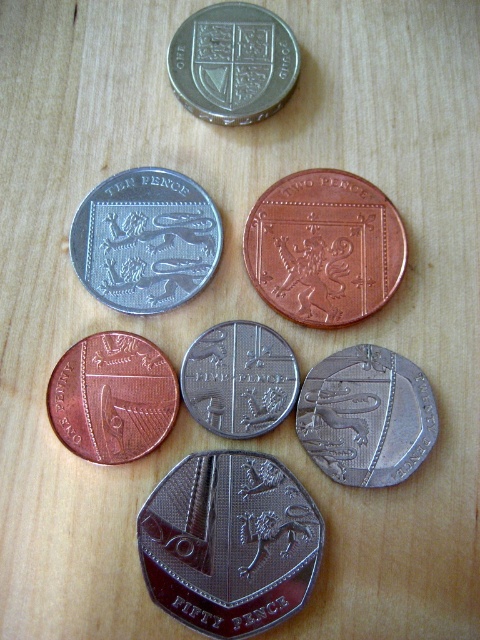
Which is below, copper metallic coin at center or silver metallic coin at upper left?

Positioned lower is copper metallic coin at center.

Can you confirm if copper metallic coin at center is positioned above silver metallic coin at upper left?

No.

Does point (368, 232) come farther from viewer compared to point (196, 212)?

No, (368, 232) is in front of (196, 212).

Identify the location of copper metallic coin at center. (324, 248).

Does silver metallic coin at upper left come behind satin silver coin at center?

Yes, it is behind satin silver coin at center.

In order to click on silver metallic coin at upper left in this screenshot , I will do `click(145, 241)`.

At what (x,y) coordinates should I click in order to perform the action: click on silver metallic coin at upper left. Please return your answer as a coordinate pair (x, y). Image resolution: width=480 pixels, height=640 pixels. Looking at the image, I should click on (145, 241).

Does copper metallic coin at center appear over silver metallic coin at center?

Yes.

Find the location of `copper metallic coin at center`. copper metallic coin at center is located at coordinates (324, 248).